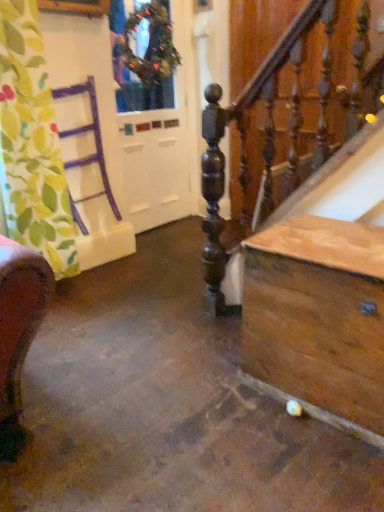
Question: In the image, is wooden chest at lower right positioned in front of or behind white glossy door at upper left?

Choices:
 (A) behind
 (B) front

Answer: (B)

Question: Based on their positions, is wooden chest at lower right located to the left or right of white glossy door at upper left?

Choices:
 (A) right
 (B) left

Answer: (A)

Question: Based on their relative distances, which object is nearer to the green leafy fabric at left?

Choices:
 (A) green textured wreath at upper center
 (B) wooden chest at lower right
 (C) white glossy door at upper left

Answer: (A)

Question: Estimate the real-world distances between objects in this image. Which object is closer to the green textured wreath at upper center?

Choices:
 (A) wooden chest at lower right
 (B) green leafy fabric at left
 (C) white glossy door at upper left

Answer: (C)